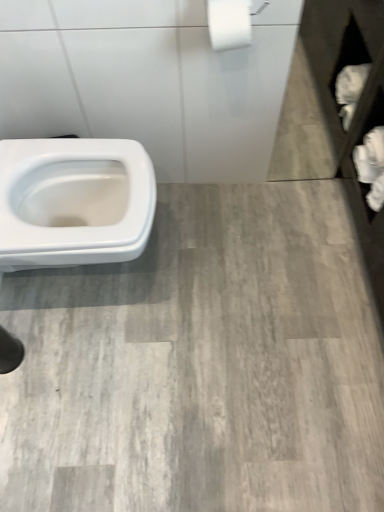
You are a GUI agent. You are given a task and a screenshot of the screen. Output one action in this format:
    pyautogui.click(x=<x>, y=<y>)
    Task: Click on the white matte toilet paper at upper right, placed as the first toilet paper when sorted from front to back
    The width and height of the screenshot is (384, 512).
    Given the screenshot: What is the action you would take?
    pyautogui.click(x=229, y=23)

The image size is (384, 512). What do you see at coordinates (229, 23) in the screenshot? I see `white matte toilet paper at upper right, positioned as the first toilet paper in top-to-bottom order` at bounding box center [229, 23].

How much space does white matte toilet paper at upper right, positioned as the first toilet paper in top-to-bottom order, occupy vertically?

white matte toilet paper at upper right, positioned as the first toilet paper in top-to-bottom order, is 7.06 inches in height.

Based on the photo, measure the distance between point (217, 11) and camera.

They are 38.27 inches apart.

In order to face white matte toilet paper at upper right, positioned as the first toilet paper in top-to-bottom order, should I rotate leftwards or rightwards?

To face it directly, rotate right by 4.757 degrees.

What is the approximate height of white matte toilet paper at right, the 1th toilet paper from the back?

It is 7.60 inches.

Identify the location of white matte toilet paper at right, the second toilet paper viewed from the top. The height and width of the screenshot is (512, 384). (371, 166).

This screenshot has width=384, height=512. Describe the element at coordinates (371, 166) in the screenshot. I see `white matte toilet paper at right, placed as the 2th toilet paper when sorted from front to back` at that location.

You are a GUI agent. You are given a task and a screenshot of the screen. Output one action in this format:
    pyautogui.click(x=<x>, y=<y>)
    Task: Click on the white matte toilet paper at upper right, placed as the first toilet paper when sorted from left to right
    
    Given the screenshot: What is the action you would take?
    pyautogui.click(x=229, y=23)

Can you confirm if white matte toilet paper at right, the 1th toilet paper when ordered from right to left, is positioned to the left of white matte toilet paper at upper right, the second toilet paper viewed from the right?

In fact, white matte toilet paper at right, the 1th toilet paper when ordered from right to left, is to the right of white matte toilet paper at upper right, the second toilet paper viewed from the right.

Between white matte toilet paper at right, the second toilet paper viewed from the top, and white matte toilet paper at upper right, positioned as the first toilet paper in top-to-bottom order, which one is positioned in front?

white matte toilet paper at upper right, positioned as the first toilet paper in top-to-bottom order, is in front.

Considering the points (362, 144) and (248, 41), which point is in front, point (362, 144) or point (248, 41)?

The point (248, 41) is more forward.

Based on the photo, from the image's perspective, is white matte toilet paper at right, the 1th toilet paper when ordered from right to left, above or below white matte toilet paper at upper right, placed as the first toilet paper when sorted from left to right?

Based on their image positions, white matte toilet paper at right, the 1th toilet paper when ordered from right to left, is located beneath white matte toilet paper at upper right, placed as the first toilet paper when sorted from left to right.

From a real-world perspective, is white matte toilet paper at right, the 1th toilet paper when ordered from right to left, on white matte toilet paper at upper right, placed as the first toilet paper when sorted from left to right?

Actually, white matte toilet paper at right, the 1th toilet paper when ordered from right to left, is physically below white matte toilet paper at upper right, placed as the first toilet paper when sorted from left to right, in the real world.

Between white matte toilet paper at right, the 2th toilet paper from the left, and white matte toilet paper at upper right, the second toilet paper viewed from the right, which one has larger width?

Wider between the two is white matte toilet paper at right, the 2th toilet paper from the left.

Considering the relative sizes of white matte toilet paper at right, the 2th toilet paper from the left, and white matte toilet paper at upper right, positioned as the first toilet paper in top-to-bottom order, in the image provided, is white matte toilet paper at right, the 2th toilet paper from the left, shorter than white matte toilet paper at upper right, positioned as the first toilet paper in top-to-bottom order,?

No, white matte toilet paper at right, the 2th toilet paper from the left, is not shorter than white matte toilet paper at upper right, positioned as the first toilet paper in top-to-bottom order.

Considering the sizes of objects white matte toilet paper at right, the 1th toilet paper when ordered from right to left, and white matte toilet paper at upper right, placed as the first toilet paper when sorted from left to right, in the image provided, who is bigger, white matte toilet paper at right, the 1th toilet paper when ordered from right to left, or white matte toilet paper at upper right, placed as the first toilet paper when sorted from left to right,?

white matte toilet paper at right, the 1th toilet paper when ordered from right to left, is bigger.

Would you say white matte toilet paper at right, placed as the 2th toilet paper when sorted from front to back, is outside white matte toilet paper at upper right, the 2th toilet paper positioned from the back?

white matte toilet paper at right, placed as the 2th toilet paper when sorted from front to back, lies outside white matte toilet paper at upper right, the 2th toilet paper positioned from the back,'s area.

Is white matte toilet paper at right, the 1th toilet paper when ordered from right to left, next to white matte toilet paper at upper right, positioned as the first toilet paper in top-to-bottom order, and touching it?

No, white matte toilet paper at right, the 1th toilet paper when ordered from right to left, is not making contact with white matte toilet paper at upper right, positioned as the first toilet paper in top-to-bottom order.

Is white matte toilet paper at right, the second toilet paper viewed from the top, facing towards white matte toilet paper at upper right, placed as the first toilet paper when sorted from front to back?

No, white matte toilet paper at right, the second toilet paper viewed from the top, is not aimed at white matte toilet paper at upper right, placed as the first toilet paper when sorted from front to back.

Could you measure the distance between white matte toilet paper at right, the 1th toilet paper from the back, and white matte toilet paper at upper right, placed as the first toilet paper when sorted from front to back?

The distance of white matte toilet paper at right, the 1th toilet paper from the back, from white matte toilet paper at upper right, placed as the first toilet paper when sorted from front to back, is 23.61 inches.

In order to click on toilet paper in front of the white matte toilet paper at right, the second toilet paper viewed from the top in this screenshot , I will do `click(229, 23)`.

Does white matte toilet paper at upper right, placed as the 2th toilet paper when sorted from bottom to top, appear on the left side of white matte toilet paper at right, placed as the first toilet paper when sorted from bottom to top?

Indeed, white matte toilet paper at upper right, placed as the 2th toilet paper when sorted from bottom to top, is positioned on the left side of white matte toilet paper at right, placed as the first toilet paper when sorted from bottom to top.

Considering the relative positions of white matte toilet paper at upper right, the second toilet paper viewed from the right, and white matte toilet paper at right, the 1th toilet paper when ordered from right to left, in the image provided, is white matte toilet paper at upper right, the second toilet paper viewed from the right, in front of white matte toilet paper at right, the 1th toilet paper when ordered from right to left,?

Yes, white matte toilet paper at upper right, the second toilet paper viewed from the right, is closer to the camera.

Considering the positions of points (247, 26) and (382, 170), is point (247, 26) closer to camera compared to point (382, 170)?

Yes, it is in front of point (382, 170).

From the image's perspective, which is below, white matte toilet paper at upper right, placed as the 2th toilet paper when sorted from bottom to top, or white matte toilet paper at right, the 2th toilet paper from the left?

white matte toilet paper at right, the 2th toilet paper from the left.

From a real-world perspective, is white matte toilet paper at upper right, the 2th toilet paper positioned from the back, physically above white matte toilet paper at right, the 2th toilet paper from the left?

Yes.

Does white matte toilet paper at upper right, placed as the first toilet paper when sorted from front to back, have a lesser width compared to white matte toilet paper at right, the second toilet paper viewed from the top?

Yes.

Who is shorter, white matte toilet paper at upper right, the 2th toilet paper positioned from the back, or white matte toilet paper at right, the second toilet paper viewed from the top?

Standing shorter between the two is white matte toilet paper at upper right, the 2th toilet paper positioned from the back.

From the picture: Does white matte toilet paper at upper right, placed as the first toilet paper when sorted from left to right, have a smaller size compared to white matte toilet paper at right, placed as the 2th toilet paper when sorted from front to back?

Yes.

Is white matte toilet paper at upper right, placed as the first toilet paper when sorted from left to right, located outside white matte toilet paper at right, placed as the first toilet paper when sorted from bottom to top?

That's correct, white matte toilet paper at upper right, placed as the first toilet paper when sorted from left to right, is outside of white matte toilet paper at right, placed as the first toilet paper when sorted from bottom to top.

Is white matte toilet paper at upper right, the second toilet paper viewed from the right, far away from white matte toilet paper at right, placed as the first toilet paper when sorted from bottom to top?

They are positioned close to each other.

Could you tell me if white matte toilet paper at upper right, placed as the first toilet paper when sorted from front to back, is turned towards white matte toilet paper at right, the 1th toilet paper when ordered from right to left?

No, white matte toilet paper at upper right, placed as the first toilet paper when sorted from front to back, is not turned towards white matte toilet paper at right, the 1th toilet paper when ordered from right to left.

What's the angular difference between white matte toilet paper at upper right, the 2th toilet paper positioned from the back, and white matte toilet paper at right, placed as the first toilet paper when sorted from bottom to top,'s facing directions?

86.2 degrees.

This screenshot has height=512, width=384. What are the coordinates of `toilet paper below the white matte toilet paper at upper right, placed as the first toilet paper when sorted from front to back (from a real-world perspective)` in the screenshot? It's located at (371, 166).

Identify the location of toilet paper that appears below the white matte toilet paper at upper right, the 2th toilet paper positioned from the back (from a real-world perspective). (371, 166).

I want to click on toilet paper that appears above the white matte toilet paper at right, the 2th toilet paper from the left (from the image's perspective), so click(x=229, y=23).